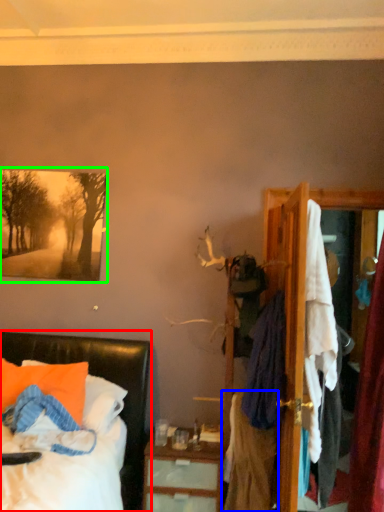
Question: Which is nearer to the bed (highlighted by a red box)? clothing (highlighted by a blue box) or picture frame (highlighted by a green box).

Choices:
 (A) clothing
 (B) picture frame

Answer: (B)